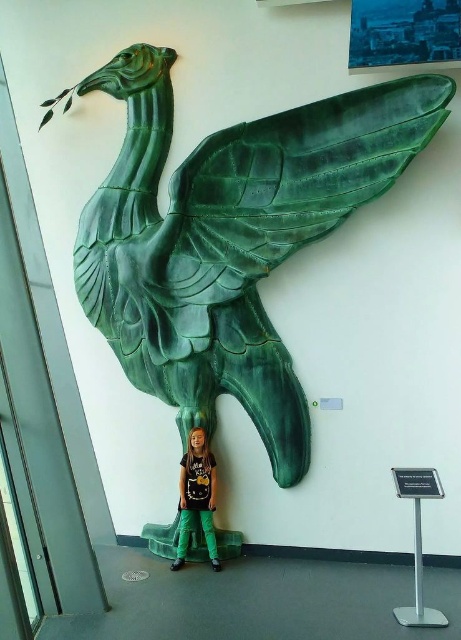
Question: Among these points, which one is farthest from the camera?

Choices:
 (A) (199, 483)
 (B) (141, 356)

Answer: (B)

Question: Can you confirm if green glossy bird at upper center is positioned above matte green pants at lower center?

Choices:
 (A) no
 (B) yes

Answer: (B)

Question: Among these objects, which one is nearest to the camera?

Choices:
 (A) matte green pants at lower center
 (B) green glossy bird at upper center

Answer: (B)

Question: Considering the relative positions of green glossy bird at upper center and matte green pants at lower center in the image provided, where is green glossy bird at upper center located with respect to matte green pants at lower center?

Choices:
 (A) left
 (B) right

Answer: (B)

Question: Can you confirm if green glossy bird at upper center is smaller than matte green pants at lower center?

Choices:
 (A) yes
 (B) no

Answer: (B)